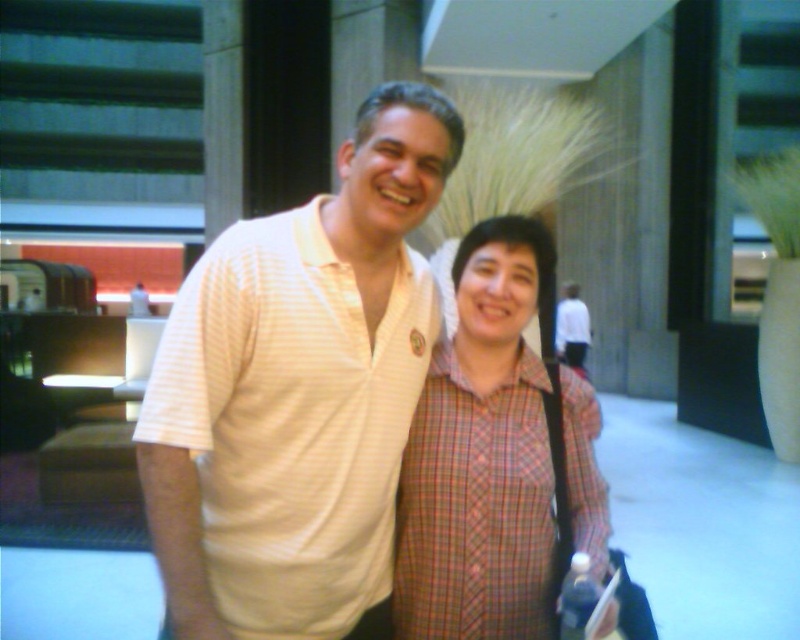
You are a photographer trying to capture both the white striped polo shirt at center and the plaid fabric shirt at center in a single shot. However, you notice that one of the shirts is blocking the other. Which shirt is being obscured by the other?

The plaid fabric shirt at center is being obscured by the white striped polo shirt at center because the white striped polo shirt at center is positioned over it.

Consider the image. You are a photographer setting up a shoot in this indoor space. You want to position a light source to the right of both the white striped polo shirt at center and the plaid fabric shirt at center. Is this possible given their current positions?

The white striped polo shirt at center is to the left of the plaid fabric shirt at center. Therefore, placing a light source to the right of both would require positioning it beyond the rightmost point of the plaid fabric shirt at center, which is feasible as long as there is space available in that direction.